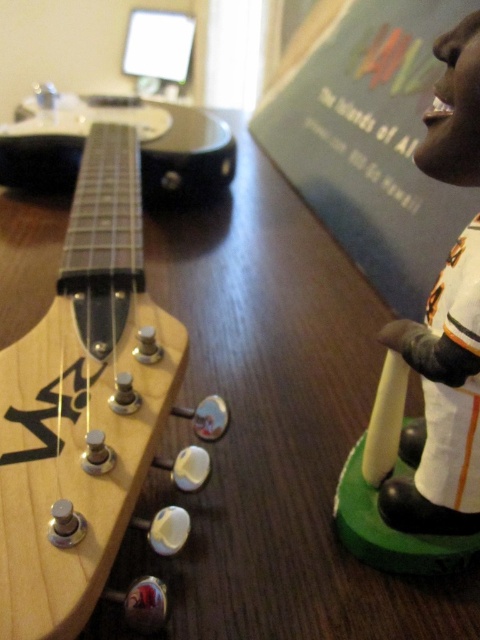
You are a photographer trying to capture a closeup of the guitar headstock and the figurine. You want to place a small LED light at point (x=87, y=404) to highlight the guitar headstock. However, you need to ensure that the light won not block the view of the figurine. Based on the scene description, will placing the light at that point obstruct the figurine?

The point (x=87, y=404) is on the natural wood guitar headstock at center left. Since the figurine is to the right of the guitar headstock, placing the light at this point would not block the view of the figurine as it is positioned on the guitar headstock itself, which is to the left of the figurine.